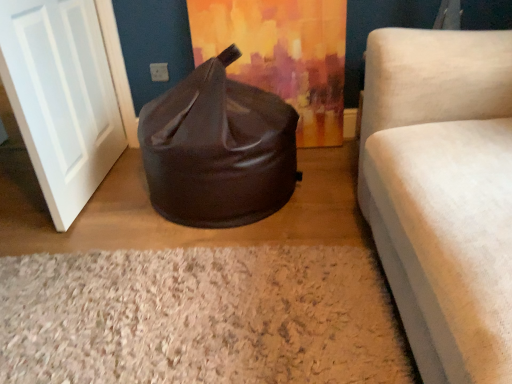
Identify the location of empty space that is in between brown leather bean bag at center and white shaggy rug at lower center. This screenshot has height=384, width=512. (200, 235).